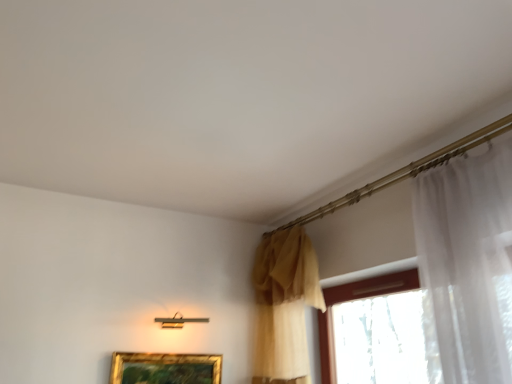
Question: In terms of height, does matte yellow curtain at center look taller or shorter compared to gold metallic picture frame at lower center?

Choices:
 (A) short
 (B) tall

Answer: (B)

Question: Considering their positions, is matte yellow curtain at center located in front of or behind gold metallic picture frame at lower center?

Choices:
 (A) behind
 (B) front

Answer: (B)

Question: Considering the relative positions of matte yellow curtain at center and gold metallic picture frame at lower center in the image provided, is matte yellow curtain at center to the left or to the right of gold metallic picture frame at lower center?

Choices:
 (A) left
 (B) right

Answer: (B)

Question: Considering the positions of point [x=155, y=360] and point [x=262, y=261], is point [x=155, y=360] closer or farther from the camera than point [x=262, y=261]?

Choices:
 (A) closer
 (B) farther

Answer: (A)

Question: Considering the positions of gold metallic picture frame at lower center and matte yellow curtain at center in the image, is gold metallic picture frame at lower center bigger or smaller than matte yellow curtain at center?

Choices:
 (A) small
 (B) big

Answer: (A)

Question: Based on their positions, is gold metallic picture frame at lower center located to the left or right of matte yellow curtain at center?

Choices:
 (A) right
 (B) left

Answer: (B)

Question: Do you think gold metallic picture frame at lower center is within matte yellow curtain at center, or outside of it?

Choices:
 (A) outside
 (B) inside

Answer: (A)